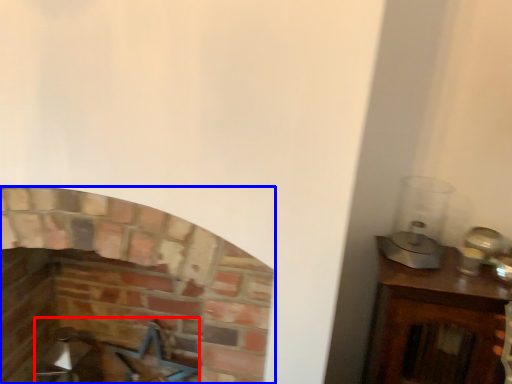
Question: Which point is further to the camera, swivel chair (highlighted by a red box) or fireplace (highlighted by a blue box)?

Choices:
 (A) swivel chair
 (B) fireplace

Answer: (A)